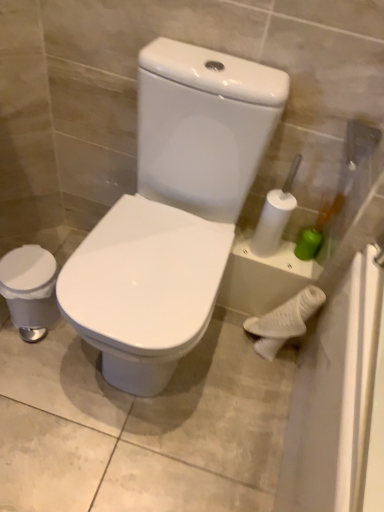
What is the approximate width of white glossy trash can at left, arranged as the 3th porcelain when viewed from the right?

The width of white glossy trash can at left, arranged as the 3th porcelain when viewed from the right, is 8.75 inches.

Measure the distance between point [295,296] and camera.

They are 4.56 feet apart.

The width and height of the screenshot is (384, 512). In order to click on white glossy trash can at left, arranged as the 3th porcelain when viewed from the right in this screenshot , I will do `click(30, 290)`.

Is white matte porcelain at lower right, marked as the 3th porcelain in a left-to-right arrangement, surrounded by white glossy toilet at center, placed as the second porcelain when sorted from left to right?

No, white matte porcelain at lower right, marked as the 3th porcelain in a left-to-right arrangement, is located outside of white glossy toilet at center, placed as the second porcelain when sorted from left to right.

Are white glossy toilet at center, placed as the second porcelain when sorted from left to right, and white matte porcelain at lower right, marked as the 3th porcelain in a left-to-right arrangement, making contact?

No, white glossy toilet at center, placed as the second porcelain when sorted from left to right, is not in contact with white matte porcelain at lower right, marked as the 3th porcelain in a left-to-right arrangement.

Would you say white glossy toilet at center, arranged as the 2th porcelain when viewed from the right, is to the left or to the right of white matte porcelain at lower right, acting as the 1th porcelain starting from the right, in the picture?

From the image, it's evident that white glossy toilet at center, arranged as the 2th porcelain when viewed from the right, is to the left of white matte porcelain at lower right, acting as the 1th porcelain starting from the right.

From the image's perspective, between white glossy toilet at center, arranged as the 2th porcelain when viewed from the right, and white matte porcelain at lower right, marked as the 3th porcelain in a left-to-right arrangement, who is located below?

white matte porcelain at lower right, marked as the 3th porcelain in a left-to-right arrangement, appears lower in the image.

Between white matte porcelain at lower right, acting as the 1th porcelain starting from the right, and white glossy toilet at center, placed as the second porcelain when sorted from left to right, which one has smaller size?

white matte porcelain at lower right, acting as the 1th porcelain starting from the right.

From the picture: In the image, is white matte porcelain at lower right, acting as the 1th porcelain starting from the right, on the left side or the right side of white glossy toilet at center, arranged as the 2th porcelain when viewed from the right?

white matte porcelain at lower right, acting as the 1th porcelain starting from the right, is positioned on white glossy toilet at center, arranged as the 2th porcelain when viewed from the right,'s right side.

From a real-world perspective, which is physically above, white matte porcelain at lower right, acting as the 1th porcelain starting from the right, or white glossy toilet at center, placed as the second porcelain when sorted from left to right?

From a 3D spatial view, white glossy toilet at center, placed as the second porcelain when sorted from left to right, is above.

Which is behind, point (220, 209) or point (12, 270)?

The point (12, 270) is behind.

Identify the location of the 1st porcelain below when counting from the white glossy toilet at center, arranged as the 2th porcelain when viewed from the right (from the image's perspective). (30, 290).

Considering the sizes of white glossy toilet at center, placed as the second porcelain when sorted from left to right, and white glossy trash can at left, arranged as the 3th porcelain when viewed from the right, in the image, is white glossy toilet at center, placed as the second porcelain when sorted from left to right, wider or thinner than white glossy trash can at left, arranged as the 3th porcelain when viewed from the right,?

In the image, white glossy toilet at center, placed as the second porcelain when sorted from left to right, appears to be wider than white glossy trash can at left, arranged as the 3th porcelain when viewed from the right.

From the picture: Can you confirm if white glossy toilet at center, placed as the second porcelain when sorted from left to right, is shorter than white glossy trash can at left, arranged as the 3th porcelain when viewed from the right?

Incorrect, the height of white glossy toilet at center, placed as the second porcelain when sorted from left to right, does not fall short of that of white glossy trash can at left, arranged as the 3th porcelain when viewed from the right.

Considering the relative sizes of white glossy trash can at left, arranged as the 3th porcelain when viewed from the right, and white matte porcelain at lower right, marked as the 3th porcelain in a left-to-right arrangement, in the image provided, is white glossy trash can at left, arranged as the 3th porcelain when viewed from the right, taller than white matte porcelain at lower right, marked as the 3th porcelain in a left-to-right arrangement,?

Incorrect, the height of white glossy trash can at left, arranged as the 3th porcelain when viewed from the right, is not larger of that of white matte porcelain at lower right, marked as the 3th porcelain in a left-to-right arrangement.

Is white glossy trash can at left, arranged as the 3th porcelain when viewed from the right, oriented towards white matte porcelain at lower right, marked as the 3th porcelain in a left-to-right arrangement?

No, white glossy trash can at left, arranged as the 3th porcelain when viewed from the right, does not turn towards white matte porcelain at lower right, marked as the 3th porcelain in a left-to-right arrangement.

Looking at this image, from the image's perspective, is white glossy trash can at left, arranged as the 3th porcelain when viewed from the right, above white matte porcelain at lower right, acting as the 1th porcelain starting from the right?

Indeed, from the image's perspective, white glossy trash can at left, arranged as the 3th porcelain when viewed from the right, is shown above white matte porcelain at lower right, acting as the 1th porcelain starting from the right.

Which is in front, point (1, 274) or point (214, 173)?

The point (214, 173) is closer to the camera.

From the image's perspective, who appears lower, white glossy trash can at left, arranged as the 3th porcelain when viewed from the right, or white glossy toilet at center, placed as the second porcelain when sorted from left to right?

From the image's view, white glossy trash can at left, arranged as the 3th porcelain when viewed from the right, is below.

Considering the sizes of white glossy trash can at left, arranged as the 3th porcelain when viewed from the right, and white glossy toilet at center, placed as the second porcelain when sorted from left to right, in the image, is white glossy trash can at left, arranged as the 3th porcelain when viewed from the right, taller or shorter than white glossy toilet at center, placed as the second porcelain when sorted from left to right,?

Considering their sizes, white glossy trash can at left, arranged as the 3th porcelain when viewed from the right, has less height than white glossy toilet at center, placed as the second porcelain when sorted from left to right.

From the picture: Which is in front, white glossy trash can at left, arranged as the 3th porcelain when viewed from the right, or white glossy toilet at center, placed as the second porcelain when sorted from left to right?

Positioned in front is white glossy toilet at center, placed as the second porcelain when sorted from left to right.

From the image's perspective, is white matte porcelain at lower right, marked as the 3th porcelain in a left-to-right arrangement, on white glossy trash can at left, the 1th porcelain in the left-to-right sequence?

Incorrect, from the image's perspective, white matte porcelain at lower right, marked as the 3th porcelain in a left-to-right arrangement, is lower than white glossy trash can at left, the 1th porcelain in the left-to-right sequence.

From a real-world perspective, is white matte porcelain at lower right, acting as the 1th porcelain starting from the right, above or below white glossy trash can at left, the 1th porcelain in the left-to-right sequence?

From a real-world perspective, white matte porcelain at lower right, acting as the 1th porcelain starting from the right, is physically above white glossy trash can at left, the 1th porcelain in the left-to-right sequence.

Which object is thinner, white matte porcelain at lower right, marked as the 3th porcelain in a left-to-right arrangement, or white glossy trash can at left, arranged as the 3th porcelain when viewed from the right?

Thinner between the two is white matte porcelain at lower right, marked as the 3th porcelain in a left-to-right arrangement.

Image resolution: width=384 pixels, height=512 pixels. I want to click on porcelain on the right of the white glossy toilet at center, placed as the second porcelain when sorted from left to right, so click(284, 321).

Locate an element on the screen. Image resolution: width=384 pixels, height=512 pixels. the 1st porcelain directly beneath the white glossy toilet at center, placed as the second porcelain when sorted from left to right (from a real-world perspective) is located at coordinates (284, 321).

Estimate the real-world distances between objects in this image. Which object is closer to white matte porcelain at lower right, marked as the 3th porcelain in a left-to-right arrangement, white glossy toilet at center, arranged as the 2th porcelain when viewed from the right, or white glossy trash can at left, the 1th porcelain in the left-to-right sequence?

The object closer to white matte porcelain at lower right, marked as the 3th porcelain in a left-to-right arrangement, is white glossy toilet at center, arranged as the 2th porcelain when viewed from the right.

Based on their spatial positions, is white glossy toilet at center, arranged as the 2th porcelain when viewed from the right, or white matte porcelain at lower right, acting as the 1th porcelain starting from the right, closer to white glossy trash can at left, the 1th porcelain in the left-to-right sequence?

Based on the image, white glossy toilet at center, arranged as the 2th porcelain when viewed from the right, appears to be nearer to white glossy trash can at left, the 1th porcelain in the left-to-right sequence.

Looking at this image, when comparing their distances from white glossy toilet at center, placed as the second porcelain when sorted from left to right, does white matte porcelain at lower right, acting as the 1th porcelain starting from the right, or white glossy trash can at left, arranged as the 3th porcelain when viewed from the right, seem closer?

white glossy trash can at left, arranged as the 3th porcelain when viewed from the right.

Looking at the image, which one is located further to white glossy toilet at center, arranged as the 2th porcelain when viewed from the right, white glossy trash can at left, the 1th porcelain in the left-to-right sequence, or white matte porcelain at lower right, acting as the 1th porcelain starting from the right?

white matte porcelain at lower right, acting as the 1th porcelain starting from the right, is positioned further to the anchor white glossy toilet at center, arranged as the 2th porcelain when viewed from the right.

From the image, which object appears to be farther from white matte porcelain at lower right, acting as the 1th porcelain starting from the right, white glossy trash can at left, arranged as the 3th porcelain when viewed from the right, or white glossy toilet at center, arranged as the 2th porcelain when viewed from the right?

white glossy trash can at left, arranged as the 3th porcelain when viewed from the right, lies further to white matte porcelain at lower right, acting as the 1th porcelain starting from the right, than the other object.

Based on their spatial positions, is white matte porcelain at lower right, marked as the 3th porcelain in a left-to-right arrangement, or white glossy toilet at center, placed as the second porcelain when sorted from left to right, closer to white glossy trash can at left, arranged as the 3th porcelain when viewed from the right?

white glossy toilet at center, placed as the second porcelain when sorted from left to right.

The image size is (384, 512). Identify the location of porcelain between white glossy trash can at left, the 1th porcelain in the left-to-right sequence, and white matte porcelain at lower right, acting as the 1th porcelain starting from the right, from left to right. 172,212.